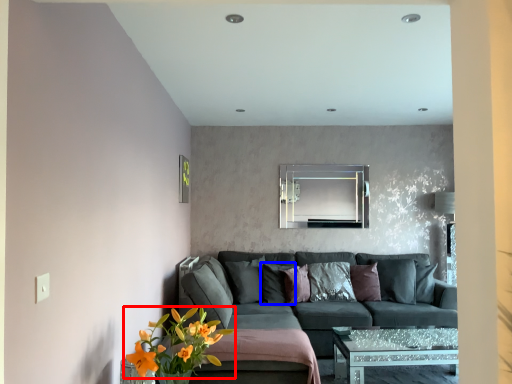
Question: Which object appears closest to the camera in this image, flower (highlighted by a red box) or pillow (highlighted by a blue box)?

Choices:
 (A) flower
 (B) pillow

Answer: (A)